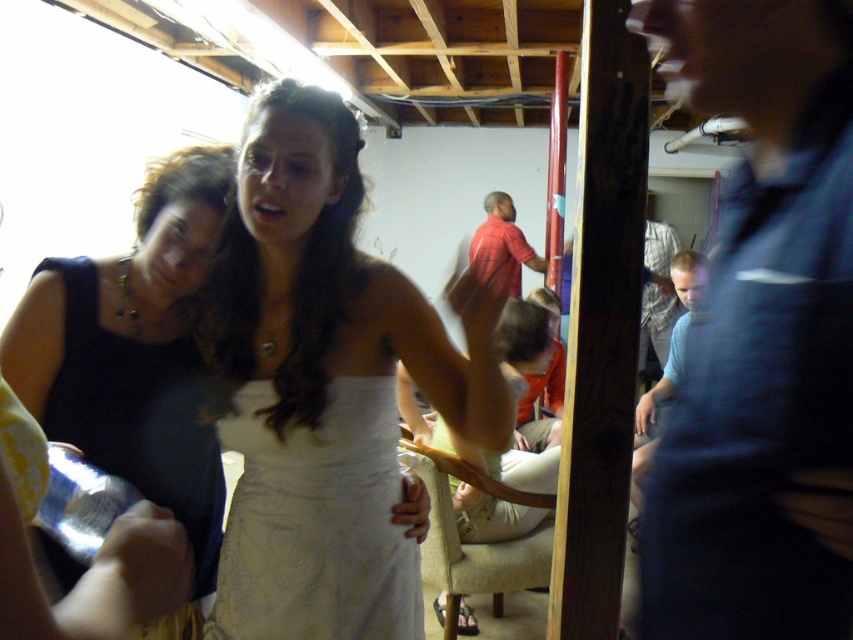
Question: Is blue cotton shirt at right closer to the viewer compared to white lace dress at center?

Choices:
 (A) no
 (B) yes

Answer: (B)

Question: Based on their relative distances, which object is nearer to the gray striped shirt at center?

Choices:
 (A) blue cotton shirt at right
 (B) black satin dress at left
 (C) white satin dress at center

Answer: (C)

Question: Which object is farther from the camera taking this photo?

Choices:
 (A) gray striped shirt at center
 (B) white satin dress at center
 (C) white lace dress at center
 (D) black satin dress at left

Answer: (A)

Question: Does blue cotton shirt at right have a larger size compared to white lace dress at center?

Choices:
 (A) yes
 (B) no

Answer: (A)

Question: Is the position of white satin dress at center less distant than that of gray striped shirt at center?

Choices:
 (A) no
 (B) yes

Answer: (B)

Question: Based on their relative distances, which object is nearer to the black satin dress at left?

Choices:
 (A) blue cotton shirt at right
 (B) white lace dress at center
 (C) gray striped shirt at center
 (D) white satin dress at center

Answer: (B)